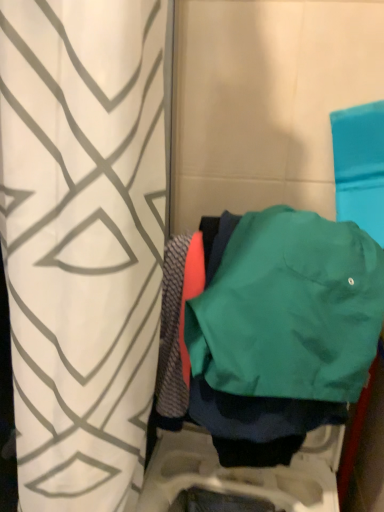
Question: In terms of height, does white geometric-patterned curtain at center look taller or shorter compared to green fabric jacket at center?

Choices:
 (A) short
 (B) tall

Answer: (B)

Question: Looking at their shapes, would you say white geometric-patterned curtain at center is wider or thinner than green fabric jacket at center?

Choices:
 (A) thin
 (B) wide

Answer: (B)

Question: Is white geometric-patterned curtain at center spatially inside green fabric jacket at center, or outside of it?

Choices:
 (A) outside
 (B) inside

Answer: (A)

Question: From their relative heights in the image, would you say green fabric jacket at center is taller or shorter than white geometric-patterned curtain at center?

Choices:
 (A) short
 (B) tall

Answer: (A)

Question: Would you say green fabric jacket at center is to the left or to the right of white geometric-patterned curtain at center in the picture?

Choices:
 (A) left
 (B) right

Answer: (B)

Question: Considering the positions of green fabric jacket at center and white geometric-patterned curtain at center in the image, is green fabric jacket at center bigger or smaller than white geometric-patterned curtain at center?

Choices:
 (A) big
 (B) small

Answer: (B)

Question: Relative to white geometric-patterned curtain at center, is green fabric jacket at center in front or behind?

Choices:
 (A) behind
 (B) front

Answer: (A)